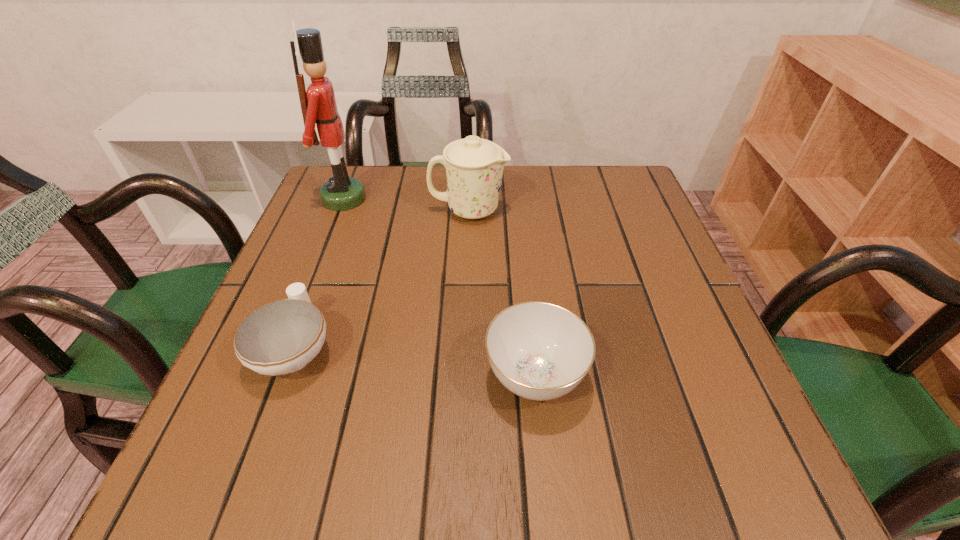
Identify the location of free space in the image that satisfies the following two spatial constraints: 1. on the front-facing side of the nutcracker; 2. on the side with the handle of the shortest chinaware. This screenshot has width=960, height=540. (285, 349).

You are a GUI agent. You are given a task and a screenshot of the screen. Output one action in this format:
    pyautogui.click(x=<x>, y=<y>)
    Task: Click on the free region that satisfies the following two spatial constraints: 1. on the spout of the second tallest object; 2. on the left side of the second shortest object
    This screenshot has height=540, width=960.
    Given the screenshot: What is the action you would take?
    pyautogui.click(x=464, y=376)

Find the location of `free space that satisfies the following two spatial constraints: 1. on the front-facing side of the second tallest chinaware; 2. on the left side of the nutcracker`. free space that satisfies the following two spatial constraints: 1. on the front-facing side of the second tallest chinaware; 2. on the left side of the nutcracker is located at coordinates (275, 376).

Locate an element on the screen. free space that satisfies the following two spatial constraints: 1. on the side with the handle of the shortest chinaware; 2. on the front-facing side of the tallest object is located at coordinates (351, 199).

Find the location of a particular element. The width and height of the screenshot is (960, 540). free space that satisfies the following two spatial constraints: 1. on the spout of the farthest chinaware; 2. on the right side of the second tallest chinaware is located at coordinates (464, 376).

The image size is (960, 540). Identify the location of free space that satisfies the following two spatial constraints: 1. on the spout of the third tallest object; 2. on the left side of the farthest chinaware. (464, 376).

At what (x,y) coordinates should I click in order to perform the action: click on free spot that satisfies the following two spatial constraints: 1. on the front-facing side of the tallest object; 2. on the side with the handle of the leftmost chinaware. Please return your answer as a coordinate pair (x, y). The width and height of the screenshot is (960, 540). Looking at the image, I should click on (285, 349).